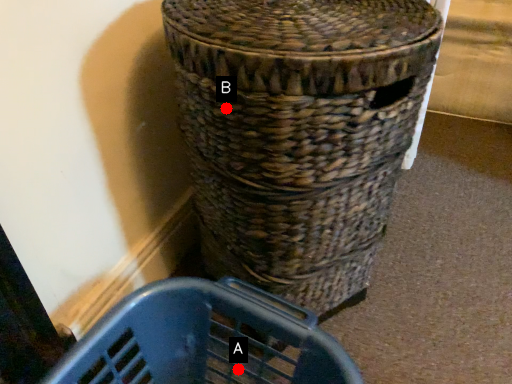
Question: Two points are circled on the image, labeled by A and B beside each circle. Which point is closer to the camera?

Choices:
 (A) A is closer
 (B) B is closer

Answer: (B)